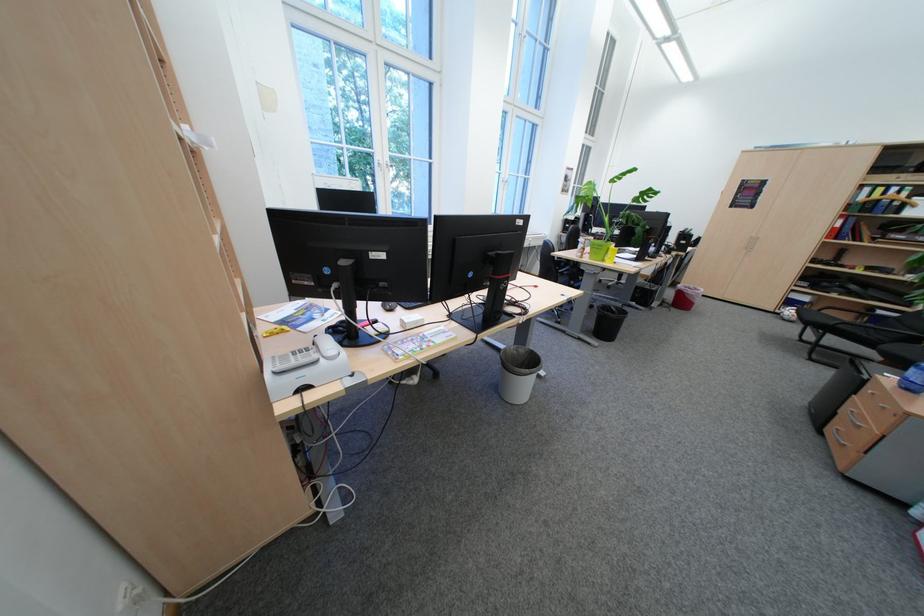
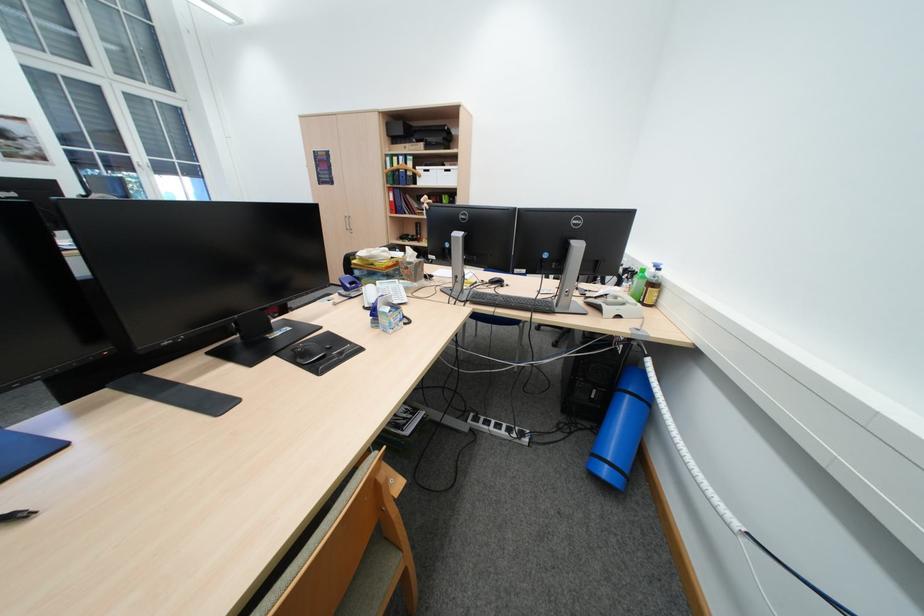
Question: I am providing you with two images of the same scene from different viewpoints. After the viewpoint changes to image2, which objects are now occluded?

Choices:
 (A) black chair armrest
 (B) small white cup
 (C) silver cabinet handle
 (D) white storage box

Answer: (A)